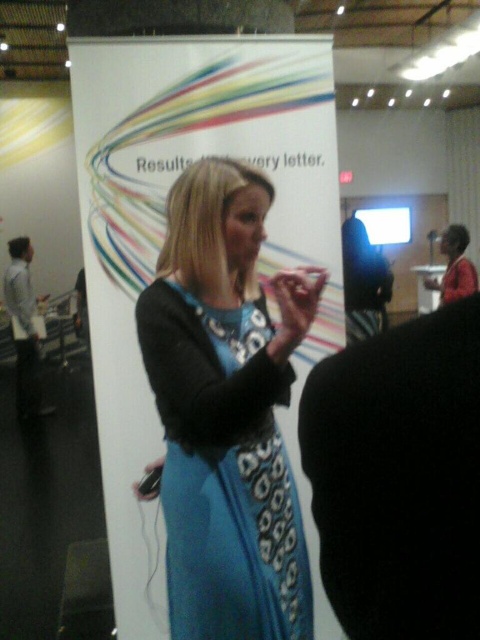
Question: Which of the following is the farthest from the observer?

Choices:
 (A) (194, 492)
 (B) (336, 154)

Answer: (B)

Question: Is the position of white paper at center more distant than that of blue printed fabric dress at center?

Choices:
 (A) yes
 (B) no

Answer: (A)

Question: Is white paper at center wider than blue printed fabric dress at center?

Choices:
 (A) yes
 (B) no

Answer: (A)

Question: Is white paper at center above blue printed fabric dress at center?

Choices:
 (A) no
 (B) yes

Answer: (B)

Question: Which point is farther from the camera taking this photo?

Choices:
 (A) (244, 339)
 (B) (313, 253)

Answer: (B)

Question: Among these objects, which one is farthest from the camera?

Choices:
 (A) white paper at center
 (B) blue printed fabric dress at center

Answer: (A)